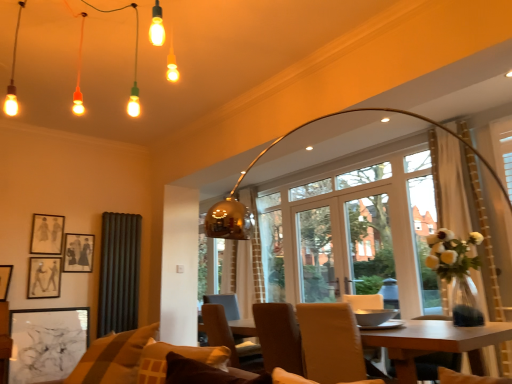
Find the location of a particular element. The height and width of the screenshot is (384, 512). free space in front of black matte picture frame at upper left, which appears as the second picture frame when ordered from the bottom is located at coordinates (30, 299).